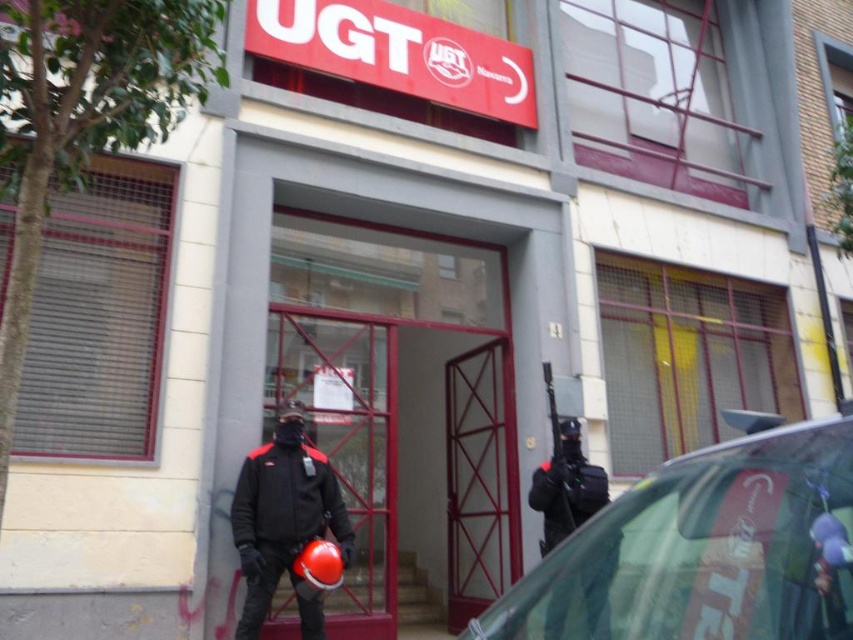
Question: Which point is closer to the camera?

Choices:
 (A) (631, 508)
 (B) (573, 506)

Answer: (A)

Question: Is black matte uniform at center behind black plastic gun at center?

Choices:
 (A) no
 (B) yes

Answer: (B)

Question: Can you confirm if black matte uniform at center is thinner than black plastic gun at center?

Choices:
 (A) no
 (B) yes

Answer: (A)

Question: Observing the image, what is the correct spatial positioning of transparent glass car at right in reference to black matte uniform at center?

Choices:
 (A) right
 (B) left

Answer: (B)

Question: Which object is closer to the camera taking this photo?

Choices:
 (A) transparent glass car at right
 (B) black plastic gun at center
 (C) matte black jacket at center
 (D) black matte uniform at center

Answer: (A)

Question: Which point is closer to the camera taking this photo?

Choices:
 (A) (583, 460)
 (B) (788, 592)
 (C) (252, 596)
 (D) (567, 474)

Answer: (B)